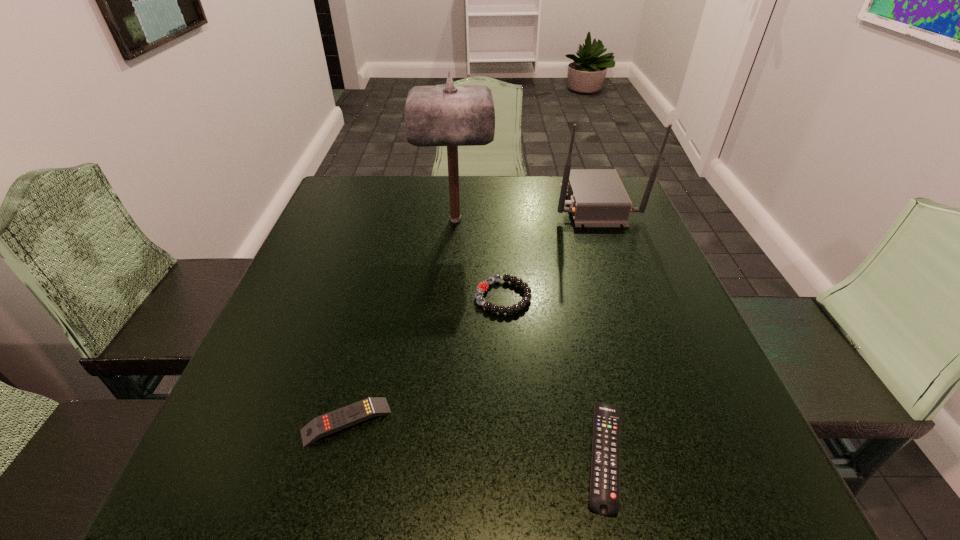
You are a GUI agent. You are given a task and a screenshot of the screen. Output one action in this format:
    pyautogui.click(x=<x>, y=<y>)
    Task: Click on the free spot between the bracelet and the right remote control
    This screenshot has width=960, height=540.
    Given the screenshot: What is the action you would take?
    pos(554,376)

Identify the location of unoccupied area between the router and the tallest object. The height and width of the screenshot is (540, 960). 524,211.

Identify the location of free space between the left remote control and the third nearest object. This screenshot has width=960, height=540. (424, 359).

Where is `vacant area that lies between the router and the right remote control`? vacant area that lies between the router and the right remote control is located at coordinates (599, 329).

Where is `object that is the third closest to the right remote control`? This screenshot has height=540, width=960. object that is the third closest to the right remote control is located at coordinates (453, 115).

Locate an element on the screen. This screenshot has width=960, height=540. object that stands as the third closest to the right remote control is located at coordinates (453, 115).

Find the location of a particular element. free spot that satisfies the following two spatial constraints: 1. on the front side of the tallest object; 2. on the left side of the right remote control is located at coordinates (437, 455).

The image size is (960, 540). I want to click on vacant point that satisfies the following two spatial constraints: 1. on the back of the fourth shortest object to connect cables; 2. on the front side of the tallest object, so click(600, 219).

Where is `vacant position in the image that satisfies the following two spatial constraints: 1. on the back side of the bracelet; 2. on the left side of the left remote control`? vacant position in the image that satisfies the following two spatial constraints: 1. on the back side of the bracelet; 2. on the left side of the left remote control is located at coordinates (378, 297).

This screenshot has width=960, height=540. Find the location of `vacant region that satisfies the following two spatial constraints: 1. on the back of the fourth shortest object to connect cables; 2. on the front side of the right remote control`. vacant region that satisfies the following two spatial constraints: 1. on the back of the fourth shortest object to connect cables; 2. on the front side of the right remote control is located at coordinates (685, 455).